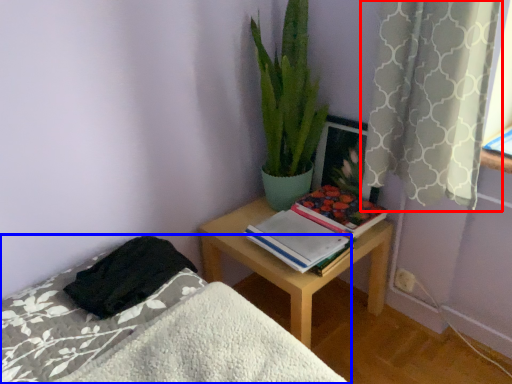
Question: Which of the following is the closest to the observer, curtain (highlighted by a red box) or bed (highlighted by a blue box)?

Choices:
 (A) curtain
 (B) bed

Answer: (B)